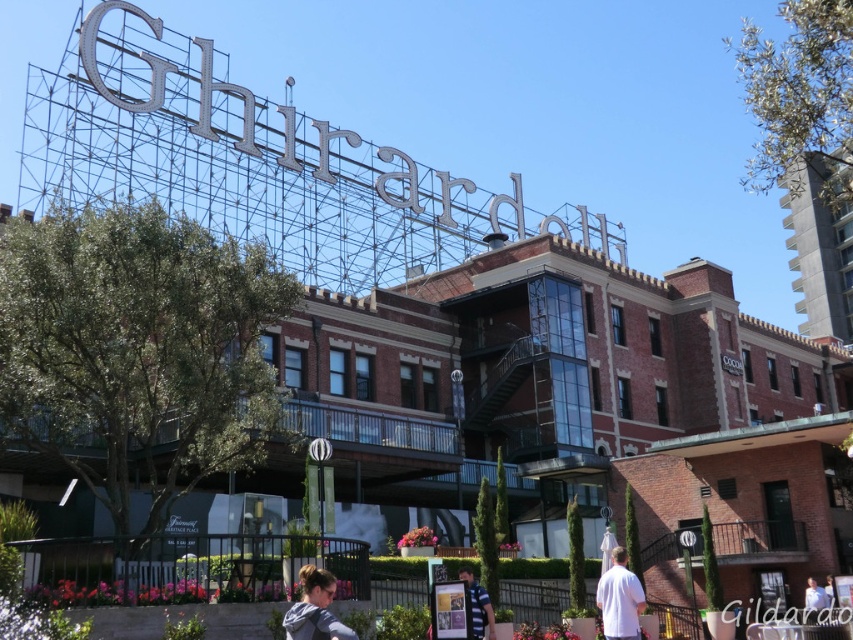
Who is positioned more to the left, blonde hair at lower center or blue striped shirt at center?

From the viewer's perspective, blonde hair at lower center appears more on the left side.

Who is more distant from viewer, (286, 621) or (474, 588)?

The point (474, 588) is more distant.

Identify the location of blonde hair at lower center. Image resolution: width=853 pixels, height=640 pixels. (315, 609).

Does white matte shirt at lower right appear on the right side of blue striped shirt at center?

Indeed, white matte shirt at lower right is positioned on the right side of blue striped shirt at center.

Is point (608, 611) closer to camera compared to point (486, 600)?

That is False.

This screenshot has height=640, width=853. I want to click on white matte shirt at lower right, so click(x=619, y=598).

Does blonde hair at lower center appear over white matte shirt at lower right?

Yes, blonde hair at lower center is above white matte shirt at lower right.

Who is lower down, blonde hair at lower center or white matte shirt at lower right?

white matte shirt at lower right is lower down.

Who is more distant from viewer, (288, 618) or (637, 589)?

Positioned behind is point (637, 589).

Locate an element on the screen. This screenshot has height=640, width=853. blonde hair at lower center is located at coordinates (315, 609).